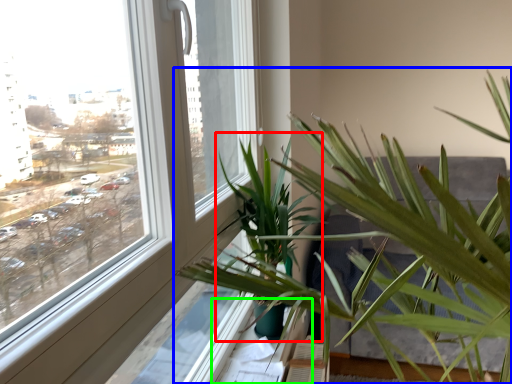
Question: Considering the real-world distances, which object is closest to palm tree (highlighted by a red box)? houseplant (highlighted by a blue box) or window sill (highlighted by a green box).

Choices:
 (A) houseplant
 (B) window sill

Answer: (A)